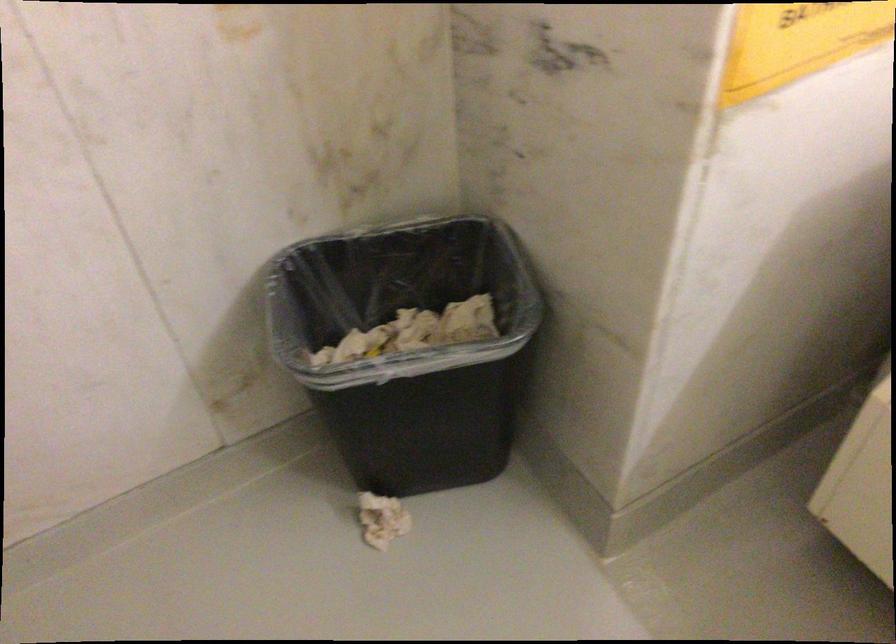
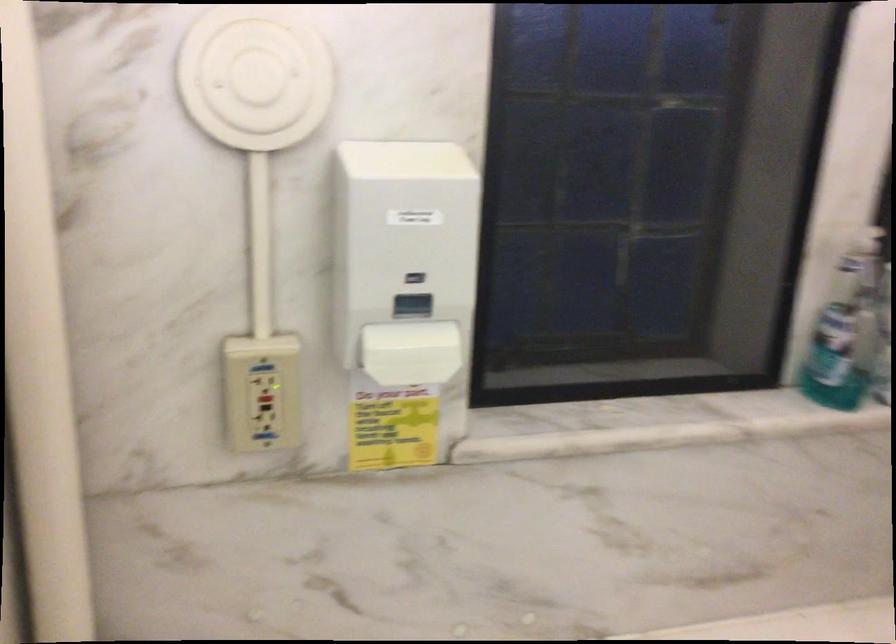
Question: The camera is either moving clockwise (left) or counter-clockwise (right) around the object. The first image is from the beginning of the video and the second image is from the end. Is the camera moving left or right when shooting the video?

Choices:
 (A) Left
 (B) Right

Answer: (A)